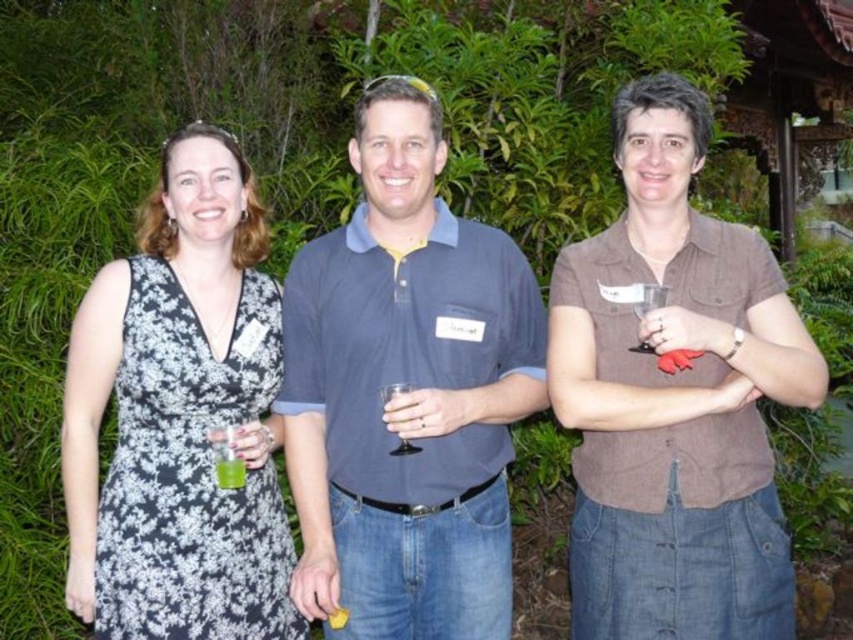
Question: Which object is farther from the camera taking this photo?

Choices:
 (A) green translucent cup at center
 (B) black floral dress at left

Answer: (A)

Question: Which of the following is the farthest from the observer?

Choices:
 (A) brown cotton shirt at right
 (B) black floral dress at left
 (C) blue cotton polo shirt at center
 (D) green translucent cup at center

Answer: (C)

Question: Is blue cotton polo shirt at center above brown cotton shirt at right?

Choices:
 (A) yes
 (B) no

Answer: (A)

Question: Does brown cotton shirt at right come in front of green translucent cup at center?

Choices:
 (A) no
 (B) yes

Answer: (A)

Question: Which object appears farthest from the camera in this image?

Choices:
 (A) brown cotton shirt at right
 (B) blue cotton polo shirt at center
 (C) black floral dress at left
 (D) green translucent cup at center

Answer: (B)

Question: Does blue cotton polo shirt at center appear over black floral dress at left?

Choices:
 (A) yes
 (B) no

Answer: (A)